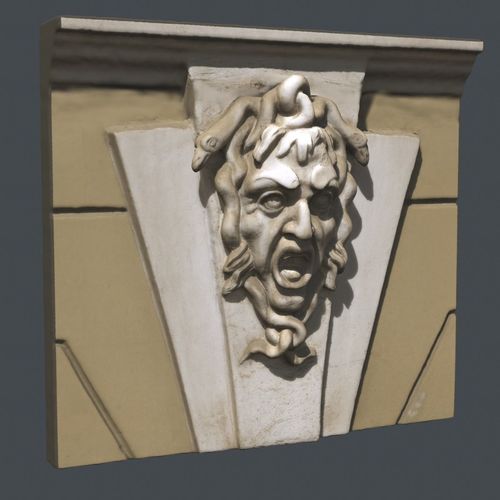
The image size is (500, 500). What are the coordinates of `statue` in the screenshot? It's located at (265, 225), (106, 339), (435, 160).